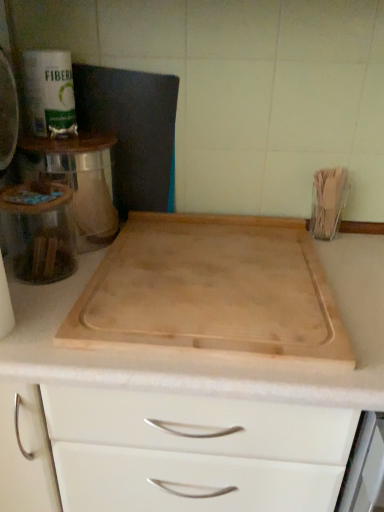
Measure the distance between metallic silver toaster at upper left, which ranks as the 2th appliance in right-to-left order, and camera.

They are 30.06 inches apart.

This screenshot has height=512, width=384. What do you see at coordinates (39, 231) in the screenshot? I see `clear glass jar at left, the second appliance positioned from the top` at bounding box center [39, 231].

What do you see at coordinates (212, 292) in the screenshot?
I see `natural wood cutting board at center` at bounding box center [212, 292].

Where is `metallic silver toaster at upper left, which is the first appliance from left to right`? metallic silver toaster at upper left, which is the first appliance from left to right is located at coordinates (8, 113).

Who is smaller, natural wood cutting board at center or natural wood cutting board at center?

natural wood cutting board at center.

Is natural wood cutting board at center beside natural wood cutting board at center?

natural wood cutting board at center and natural wood cutting board at center are clearly separated.

Is natural wood cutting board at center inside or outside of natural wood cutting board at center?

natural wood cutting board at center is enclosed within natural wood cutting board at center.

Based on the photo, is natural wood cutting board at center at the back of natural wood cutting board at center?

Absolutely, natural wood cutting board at center is directed away from natural wood cutting board at center.

Considering the sizes of objects metallic silver toaster at upper left, which is counted as the 1th appliance, starting from the top, and natural wood cutting board at center in the image provided, who is taller, metallic silver toaster at upper left, which is counted as the 1th appliance, starting from the top, or natural wood cutting board at center?

Standing taller between the two is metallic silver toaster at upper left, which is counted as the 1th appliance, starting from the top.

Considering the positions of objects metallic silver toaster at upper left, which ranks as the 2th appliance in right-to-left order, and natural wood cutting board at center in the image provided, who is in front, metallic silver toaster at upper left, which ranks as the 2th appliance in right-to-left order, or natural wood cutting board at center?

natural wood cutting board at center is closer to the camera.

From the image's perspective, does metallic silver toaster at upper left, which is the first appliance from left to right, appear lower than natural wood cutting board at center?

No, from the image's perspective, metallic silver toaster at upper left, which is the first appliance from left to right, is not beneath natural wood cutting board at center.

Does natural wood cutting board at center touch natural wood cutting board at center?

No, natural wood cutting board at center is not next to natural wood cutting board at center.

Considering the sizes of objects natural wood cutting board at center and natural wood cutting board at center in the image provided, who is bigger, natural wood cutting board at center or natural wood cutting board at center?

Bigger between the two is natural wood cutting board at center.

From a real-world perspective, which object stands above the other?

From a 3D spatial view, natural wood cutting board at center is above.

Considering the relative sizes of natural wood cutting board at center and natural wood cutting board at center in the image provided, is natural wood cutting board at center taller than natural wood cutting board at center?

Yes.

Can you confirm if metallic silver toaster at upper left, which is counted as the 1th appliance, starting from the top, is taller than natural wood cutting board at center?

No, metallic silver toaster at upper left, which is counted as the 1th appliance, starting from the top, is not taller than natural wood cutting board at center.

Is point (0, 47) positioned after point (289, 372)?

Yes, it is behind point (289, 372).

Looking at this image, can you confirm if metallic silver toaster at upper left, which ranks as the 2th appliance in right-to-left order, is smaller than natural wood cutting board at center?

Yes.

Is metallic silver toaster at upper left, which ranks as the second appliance in bottom-to-top order, facing towards natural wood cutting board at center?

No, metallic silver toaster at upper left, which ranks as the second appliance in bottom-to-top order, is not facing towards natural wood cutting board at center.

Which object is positioned more to the right, natural wood cutting board at center or metallic silver toaster at upper left, which ranks as the second appliance in bottom-to-top order?

natural wood cutting board at center is more to the right.

Could you measure the distance between natural wood cutting board at center and metallic silver toaster at upper left, which is the first appliance from left to right?

natural wood cutting board at center is 45.24 centimeters away from metallic silver toaster at upper left, which is the first appliance from left to right.

From a real-world perspective, is natural wood cutting board at center over metallic silver toaster at upper left, which ranks as the 2th appliance in right-to-left order?

No, from a real-world perspective, natural wood cutting board at center is not over metallic silver toaster at upper left, which ranks as the 2th appliance in right-to-left order

Can you confirm if natural wood cutting board at center is thinner than metallic silver toaster at upper left, which is counted as the 1th appliance, starting from the top?

No, natural wood cutting board at center is not thinner than metallic silver toaster at upper left, which is counted as the 1th appliance, starting from the top.

Is the position of clear glass jar at left, the second appliance positioned from the top, more distant than that of natural wood cutting board at center?

Yes.

How far apart are clear glass jar at left, the second appliance positioned from the top, and natural wood cutting board at center?

clear glass jar at left, the second appliance positioned from the top, and natural wood cutting board at center are 9.27 inches apart from each other.

Is clear glass jar at left, the second appliance positioned from the top, taller than natural wood cutting board at center?

No.

Which is behind, natural wood cutting board at center or clear glass jar at left, which ranks as the first appliance in right-to-left order?

clear glass jar at left, which ranks as the first appliance in right-to-left order, is further from the camera.

Is natural wood cutting board at center turned away from clear glass jar at left, which ranks as the first appliance in right-to-left order?

No, natural wood cutting board at center's orientation is not away from clear glass jar at left, which ranks as the first appliance in right-to-left order.

From the picture: Who is smaller, natural wood cutting board at center or clear glass jar at left, which ranks as the first appliance in right-to-left order?

With smaller size is clear glass jar at left, which ranks as the first appliance in right-to-left order.

Is natural wood cutting board at center not within clear glass jar at left, which ranks as the first appliance in right-to-left order?

Yes, natural wood cutting board at center is not within clear glass jar at left, which ranks as the first appliance in right-to-left order.

The height and width of the screenshot is (512, 384). What are the coordinates of `cutting board lying above the natural wood cutting board at center (from the image's perspective)` in the screenshot? It's located at (212, 292).

This screenshot has width=384, height=512. Identify the location of cutting board in front of the metallic silver toaster at upper left, which is the first appliance from left to right. (212, 292).

Consider the image. Estimate the real-world distances between objects in this image. Which object is closer to natural wood cutting board at center, metallic silver toaster at upper left, which is the first appliance from left to right, or clear glass jar at left, positioned as the 1th appliance in bottom-to-top order?

clear glass jar at left, positioned as the 1th appliance in bottom-to-top order, lies closer to natural wood cutting board at center than the other object.

Based on their spatial positions, is natural wood cutting board at center or natural wood cutting board at center closer to clear glass jar at left, positioned as the 1th appliance in bottom-to-top order?

natural wood cutting board at center is positioned closer to the anchor clear glass jar at left, positioned as the 1th appliance in bottom-to-top order.

Which object lies nearer to the anchor point natural wood cutting board at center, natural wood cutting board at center or metallic silver toaster at upper left, which is counted as the 1th appliance, starting from the top?

natural wood cutting board at center.

Considering their positions, is clear glass jar at left, the second appliance positioned from the left, positioned further to natural wood cutting board at center than natural wood cutting board at center?

clear glass jar at left, the second appliance positioned from the left, is positioned further to the anchor natural wood cutting board at center.

Looking at the image, which one is located closer to natural wood cutting board at center, natural wood cutting board at center or clear glass jar at left, the second appliance positioned from the top?

Based on the image, natural wood cutting board at center appears to be nearer to natural wood cutting board at center.

Based on their spatial positions, is natural wood cutting board at center or natural wood cutting board at center closer to metallic silver toaster at upper left, which ranks as the 2th appliance in right-to-left order?

Among the two, natural wood cutting board at center is located nearer to metallic silver toaster at upper left, which ranks as the 2th appliance in right-to-left order.

Based on their spatial positions, is natural wood cutting board at center or metallic silver toaster at upper left, which is counted as the 1th appliance, starting from the top, further from clear glass jar at left, positioned as the 1th appliance in bottom-to-top order?

Among the two, natural wood cutting board at center is located further to clear glass jar at left, positioned as the 1th appliance in bottom-to-top order.

Considering their positions, is metallic silver toaster at upper left, which ranks as the second appliance in bottom-to-top order, positioned further to clear glass jar at left, which ranks as the first appliance in right-to-left order, than natural wood cutting board at center?

The object further to clear glass jar at left, which ranks as the first appliance in right-to-left order, is natural wood cutting board at center.

Locate an element on the screen. The image size is (384, 512). cutting board between clear glass jar at left, the second appliance positioned from the top, and natural wood cutting board at center, in the vertical direction is located at coordinates (212, 292).

You are a GUI agent. You are given a task and a screenshot of the screen. Output one action in this format:
    pyautogui.click(x=<x>, y=<y>)
    Task: Click on the appliance between metallic silver toaster at upper left, which ranks as the 2th appliance in right-to-left order, and natural wood cutting board at center, in the vertical direction
    Image resolution: width=384 pixels, height=512 pixels.
    Given the screenshot: What is the action you would take?
    point(39,231)

Identify the location of cutting board between metallic silver toaster at upper left, which ranks as the 2th appliance in right-to-left order, and natural wood cutting board at center, in the vertical direction. (212, 292).

Find the location of a particular element. appliance between metallic silver toaster at upper left, which ranks as the second appliance in bottom-to-top order, and natural wood cutting board at center from left to right is located at coordinates (39, 231).